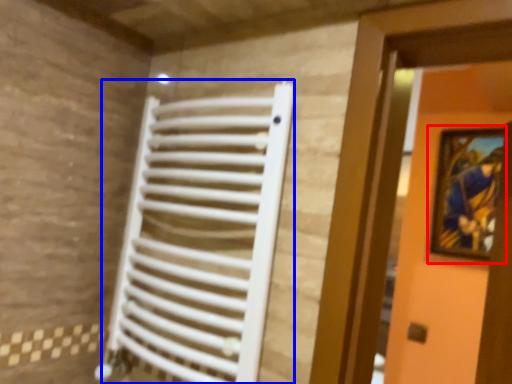
Question: Which object is further to the camera taking this photo, picture frame (highlighted by a red box) or radiator (highlighted by a blue box)?

Choices:
 (A) picture frame
 (B) radiator

Answer: (A)